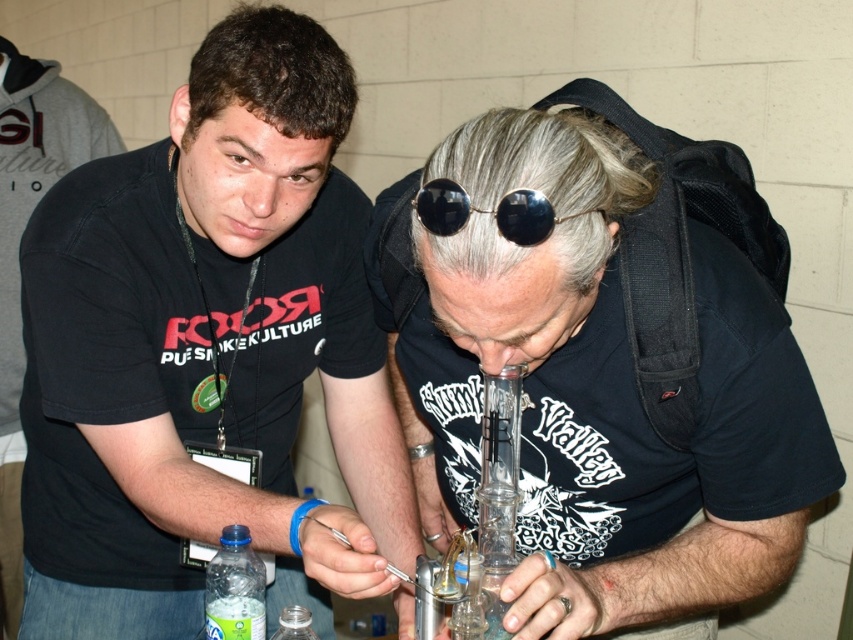
Question: Is black matte t-shirt at left bigger than clear plastic bottle at lower left?

Choices:
 (A) yes
 (B) no

Answer: (A)

Question: Can you confirm if black matte t-shirt at left is thinner than clear glass bottle at lower center?

Choices:
 (A) no
 (B) yes

Answer: (A)

Question: Is black matte t-shirt at left below black reflective sunglasses at center?

Choices:
 (A) no
 (B) yes

Answer: (B)

Question: Among these objects, which one is farthest from the camera?

Choices:
 (A) clear glass pipe at center
 (B) transparent glass bong at center
 (C) clear plastic bottle at lower left
 (D) black reflective sunglasses at center

Answer: (C)

Question: Which point appears closest to the camera in this image?

Choices:
 (A) (517, 477)
 (B) (451, 209)
 (C) (265, 401)
 (D) (297, 628)

Answer: (B)

Question: Which object is the farthest from the clear glass pipe at center?

Choices:
 (A) clear plastic bottle at lower left
 (B) black reflective sunglasses at center
 (C) black matte t-shirt at left

Answer: (A)